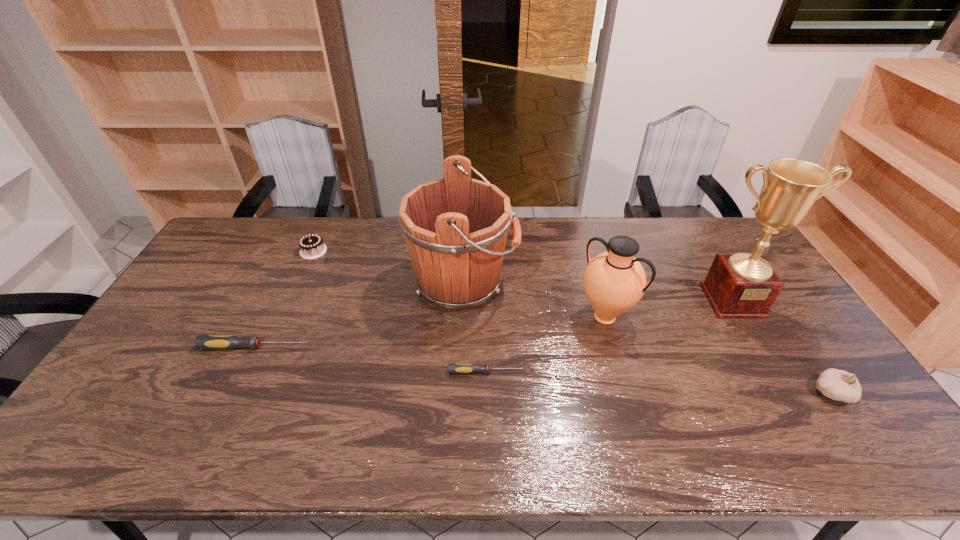
This screenshot has width=960, height=540. Find the location of `object located at the near edge`. object located at the near edge is located at coordinates (838, 385).

Find the location of `trophy cup at the right edge`. trophy cup at the right edge is located at coordinates (738, 286).

Find the location of `garlic located at the right edge`. garlic located at the right edge is located at coordinates (838, 385).

Find the location of a particular element. object that is at the near right corner is located at coordinates (838, 385).

This screenshot has height=540, width=960. In the image, there is a desktop. Identify the location of blank space at the far edge. (529, 220).

The image size is (960, 540). Identify the location of free space at the near edge. (473, 403).

Identify the location of free space at the left edge of the desktop. This screenshot has width=960, height=540. (153, 376).

This screenshot has width=960, height=540. Identify the location of vacant space at the far right corner. (710, 235).

In the image, there is a desktop. Identify the location of free region at the near right corner. (872, 419).

Where is `free space that is in between the garlic and the shorter screwdriver`? This screenshot has width=960, height=540. free space that is in between the garlic and the shorter screwdriver is located at coordinates (660, 382).